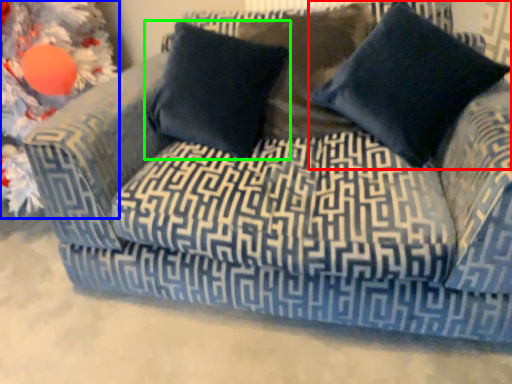
Question: Considering the real-world distances, which object is farthest from pillow (highlighted by a red box)? christmas decoration (highlighted by a blue box) or pillow (highlighted by a green box)?

Choices:
 (A) christmas decoration
 (B) pillow

Answer: (A)